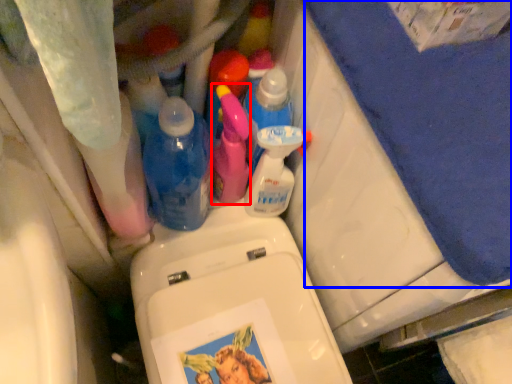
Question: Which point is closer to the camera, cleaning product (highlighted by a red box) or bath towel (highlighted by a blue box)?

Choices:
 (A) cleaning product
 (B) bath towel

Answer: (B)